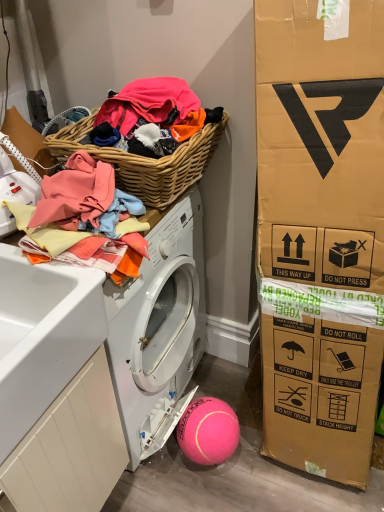
Question: From the image's perspective, is pink rubber ball at lower center positioned above or below white matte washer at left?

Choices:
 (A) below
 (B) above

Answer: (A)

Question: Based on their sizes in the image, would you say pink rubber ball at lower center is bigger or smaller than white matte washer at left?

Choices:
 (A) small
 (B) big

Answer: (A)

Question: Which object is the farthest from the pink rubber ball at lower center?

Choices:
 (A) woven wood picnic basket at upper left
 (B) white wood drawer at lower left
 (C) white matte washer at left
 (D) soft cotton towels at upper left

Answer: (C)

Question: Which object is positioned closest to the soft cotton towels at upper left?

Choices:
 (A) white wood drawer at lower left
 (B) pink rubber ball at lower center
 (C) woven wood picnic basket at upper left
 (D) white matte washer at left

Answer: (C)